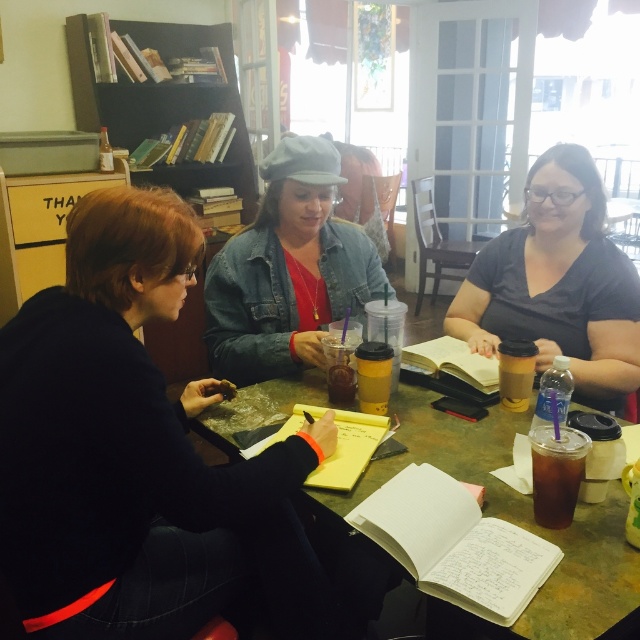
Question: Is dark gray matte shirt at center in front of black wood bookshelf at upper left?

Choices:
 (A) yes
 (B) no

Answer: (A)

Question: Is denim jacket at center to the left of yellow matte cup at center from the viewer's perspective?

Choices:
 (A) no
 (B) yes

Answer: (B)

Question: Is green marble table at center to the right of translucent plastic cup at center from the viewer's perspective?

Choices:
 (A) no
 (B) yes

Answer: (A)

Question: Which object is the farthest from the black wood bookshelf at upper left?

Choices:
 (A) yellow matte cup at center
 (B) green marble table at center

Answer: (A)

Question: Which point is farther to the camera?

Choices:
 (A) dark gray matte shirt at center
 (B) translucent plastic cup at center

Answer: (A)

Question: Which object is positioned farthest from the dark gray matte shirt at center?

Choices:
 (A) dark brown glass at lower right
 (B) denim jacket at center
 (C) yellow matte cup at center
 (D) black matte jacket at center

Answer: (D)